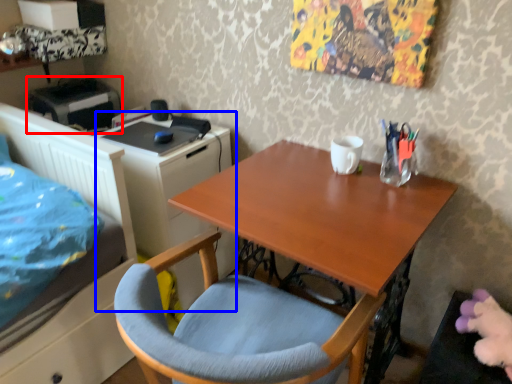
Question: Which object is further to the camera taking this photo, printer (highlighted by a red box) or file cabinet (highlighted by a blue box)?

Choices:
 (A) printer
 (B) file cabinet

Answer: (A)